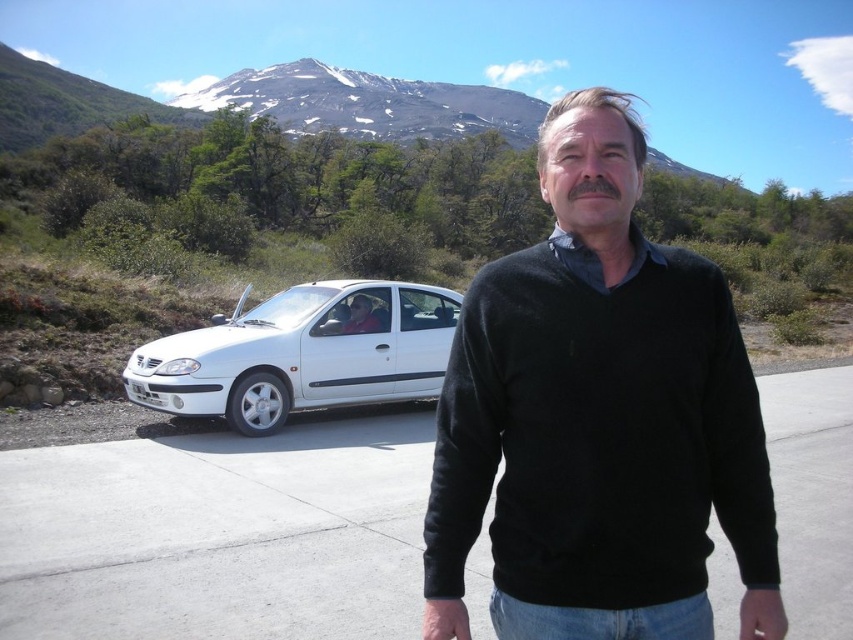
Can you confirm if black sweater at center is positioned to the left of snowy volcanic peak at upper center?

Incorrect, black sweater at center is not on the left side of snowy volcanic peak at upper center.

Does black sweater at center come behind snowy volcanic peak at upper center?

No, black sweater at center is in front of snowy volcanic peak at upper center.

Describe the element at coordinates (598, 419) in the screenshot. The image size is (853, 640). I see `black sweater at center` at that location.

Locate an element on the screen. Image resolution: width=853 pixels, height=640 pixels. black sweater at center is located at coordinates (598, 419).

Is black sweater at center to the right of white matte sedan at left from the viewer's perspective?

Correct, you'll find black sweater at center to the right of white matte sedan at left.

At what (x,y) coordinates should I click in order to perform the action: click on black sweater at center. Please return your answer as a coordinate pair (x, y). The height and width of the screenshot is (640, 853). Looking at the image, I should click on (598, 419).

Where is `black sweater at center`? The width and height of the screenshot is (853, 640). black sweater at center is located at coordinates (x=598, y=419).

Is white matte sedan at left below snowy volcanic peak at upper center?

Yes.

The width and height of the screenshot is (853, 640). Describe the element at coordinates (300, 353) in the screenshot. I see `white matte sedan at left` at that location.

Between point (393, 324) and point (358, 97), which one is positioned behind?

Positioned behind is point (358, 97).

The height and width of the screenshot is (640, 853). I want to click on white matte sedan at left, so click(x=300, y=353).